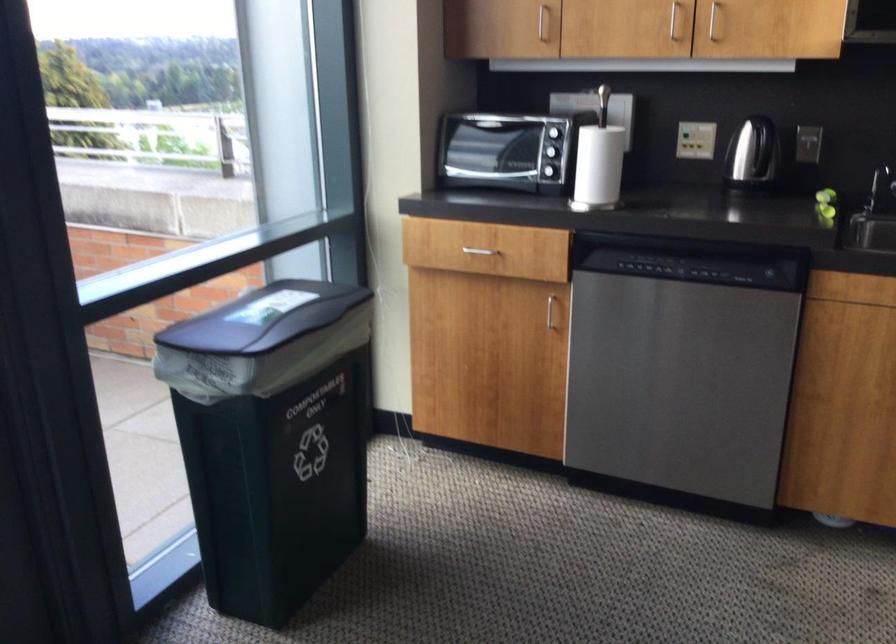
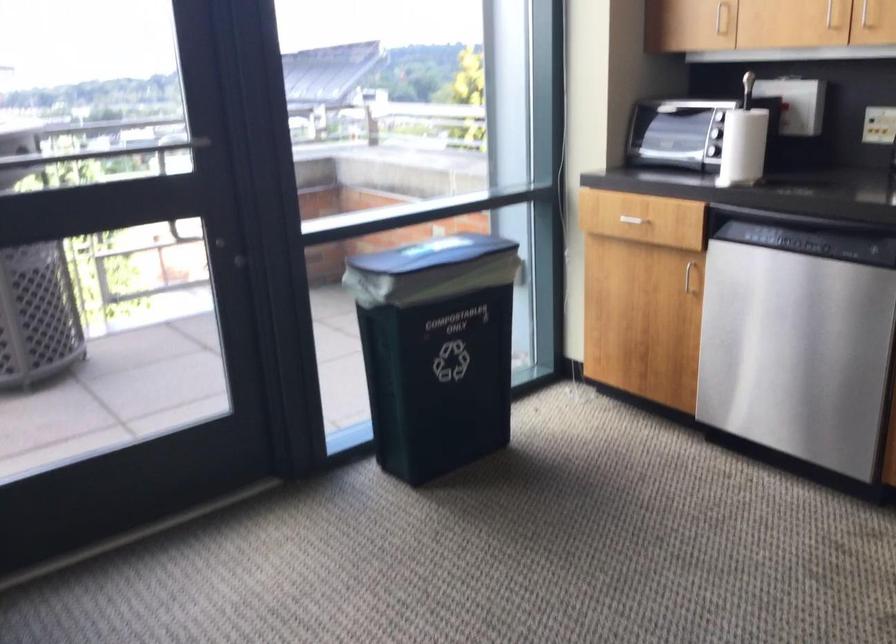
The point at (x=599, y=164) is marked in the first image. Where is the corresponding point in the second image?

(743, 146)